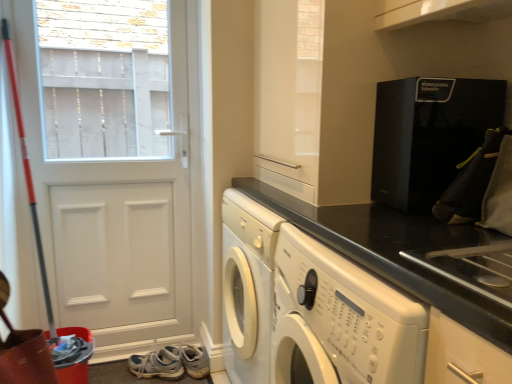
Question: Considering their positions, is black textured coffee machine at upper right located in front of or behind black granite countertop at center?

Choices:
 (A) front
 (B) behind

Answer: (A)

Question: Does point (434, 165) appear closer or farther from the camera than point (462, 291)?

Choices:
 (A) farther
 (B) closer

Answer: (A)

Question: Which of these objects is positioned farthest from the black textured coffee machine at upper right?

Choices:
 (A) black granite countertop at center
 (B) white matte door at left
 (C) white leather shoe at lower left

Answer: (C)

Question: Which object is positioned farthest from the white leather shoe at lower left?

Choices:
 (A) white matte door at left
 (B) black granite countertop at center
 (C) black textured coffee machine at upper right

Answer: (C)